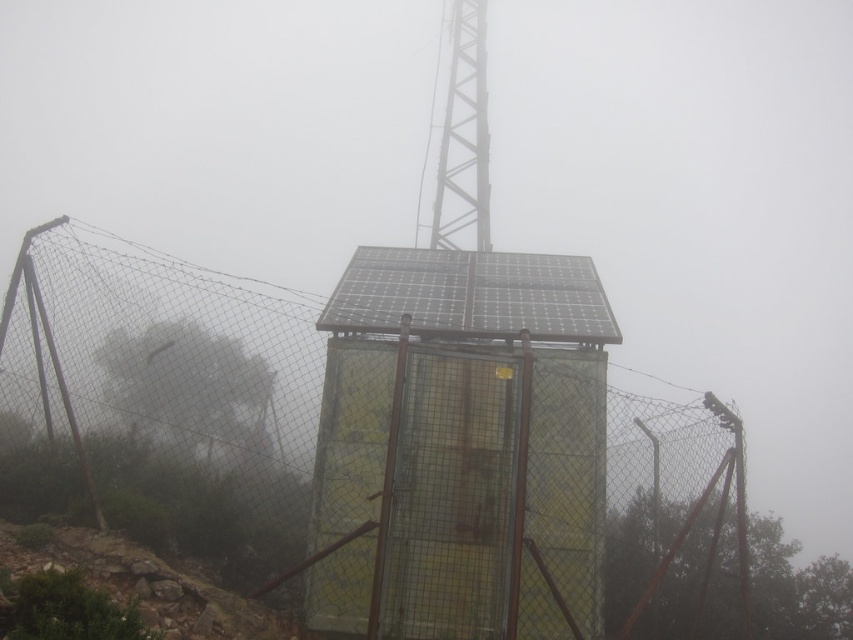
Question: Considering the real-world distances, which object is farthest from the wire mesh fence at center?

Choices:
 (A) metallic yellow cage at center
 (B) metallic gray tower at upper center

Answer: (B)

Question: Where is metallic yellow cage at center located in relation to metallic gray tower at upper center in the image?

Choices:
 (A) above
 (B) below

Answer: (B)

Question: Does wire mesh fence at center appear over metallic gray tower at upper center?

Choices:
 (A) no
 (B) yes

Answer: (A)

Question: Considering the real-world distances, which object is closest to the metallic gray tower at upper center?

Choices:
 (A) wire mesh fence at center
 (B) metallic yellow cage at center

Answer: (B)

Question: Can you confirm if wire mesh fence at center is bigger than metallic gray tower at upper center?

Choices:
 (A) yes
 (B) no

Answer: (A)

Question: Estimate the real-world distances between objects in this image. Which object is farther from the metallic yellow cage at center?

Choices:
 (A) metallic gray tower at upper center
 (B) wire mesh fence at center

Answer: (A)